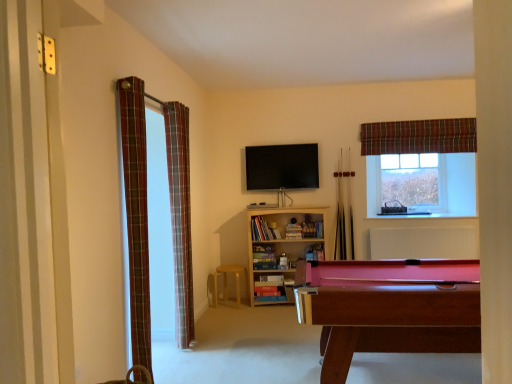
Question: Is mahogany wood pool table at lower right positioned beyond the bounds of light brown wooden stool at center?

Choices:
 (A) no
 (B) yes

Answer: (B)

Question: Could you tell me if mahogany wood pool table at lower right is turned towards light brown wooden stool at center?

Choices:
 (A) yes
 (B) no

Answer: (B)

Question: Is mahogany wood pool table at lower right taller than light brown wooden stool at center?

Choices:
 (A) no
 (B) yes

Answer: (B)

Question: Is mahogany wood pool table at lower right at the left side of light brown wooden stool at center?

Choices:
 (A) no
 (B) yes

Answer: (A)

Question: Would you say mahogany wood pool table at lower right contains light brown wooden stool at center?

Choices:
 (A) yes
 (B) no

Answer: (B)

Question: From the image's perspective, relative to plaid fabric curtain at left, acting as the 2th curtain starting from the back, is wooden bookshelf at center above or below?

Choices:
 (A) below
 (B) above

Answer: (A)

Question: Relative to plaid fabric curtain at left, acting as the 2th curtain starting from the back, is wooden bookshelf at center in front or behind?

Choices:
 (A) front
 (B) behind

Answer: (B)

Question: Does point (251, 269) appear closer or farther from the camera than point (176, 279)?

Choices:
 (A) closer
 (B) farther

Answer: (B)

Question: In terms of height, does wooden bookshelf at center look taller or shorter compared to plaid fabric curtain at left, the second curtain in the front-to-back sequence?

Choices:
 (A) tall
 (B) short

Answer: (B)

Question: In terms of height, does plaid fabric curtain at left, positioned as the first curtain in left-to-right order, look taller or shorter compared to mahogany wood pool table at lower right?

Choices:
 (A) tall
 (B) short

Answer: (A)

Question: From a real-world perspective, relative to mahogany wood pool table at lower right, is plaid fabric curtain at left, the third curtain in the right-to-left sequence, vertically above or below?

Choices:
 (A) below
 (B) above

Answer: (B)

Question: Is plaid fabric curtain at left, positioned as the first curtain in left-to-right order, to the left or to the right of mahogany wood pool table at lower right in the image?

Choices:
 (A) right
 (B) left

Answer: (B)

Question: From the image's perspective, is plaid fabric curtain at left, the third curtain when ordered from back to front, above or below mahogany wood pool table at lower right?

Choices:
 (A) below
 (B) above

Answer: (B)

Question: In the image, is clear glass window at upper right on the left side or the right side of plaid fabric curtain at left, which ranks as the second curtain in right-to-left order?

Choices:
 (A) left
 (B) right

Answer: (B)

Question: Does point (406, 208) appear closer or farther from the camera than point (170, 200)?

Choices:
 (A) closer
 (B) farther

Answer: (B)